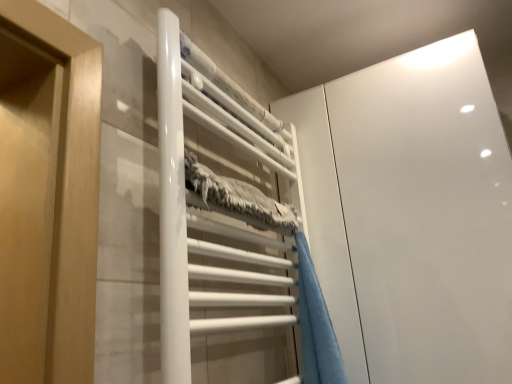
This screenshot has height=384, width=512. Describe the element at coordinates (326, 221) in the screenshot. I see `blue plush towel at center` at that location.

Measure the distance between white glossy cabinet at upper right and camera.

The distance of white glossy cabinet at upper right from camera is 34.53 inches.

This screenshot has width=512, height=384. What do you see at coordinates (210, 208) in the screenshot?
I see `white glossy towel rack at center` at bounding box center [210, 208].

Where is `blue plush towel at center`? Image resolution: width=512 pixels, height=384 pixels. blue plush towel at center is located at coordinates (326, 221).

Which of these two, white glossy cabinet at upper right or white glossy towel rack at center, stands shorter?

white glossy towel rack at center.

How distant is white glossy cabinet at upper right from white glossy towel rack at center?

white glossy cabinet at upper right and white glossy towel rack at center are 31.27 centimeters apart from each other.

From the picture: Is white glossy cabinet at upper right directly adjacent to white glossy towel rack at center?

No, white glossy cabinet at upper right is not in contact with white glossy towel rack at center.

Looking at the image, does white glossy cabinet at upper right seem bigger or smaller compared to white glossy towel rack at center?

In the image, white glossy cabinet at upper right appears to be larger than white glossy towel rack at center.

Does white glossy cabinet at upper right have a smaller size compared to blue plush towel at center?

Actually, white glossy cabinet at upper right might be larger than blue plush towel at center.

You are a GUI agent. You are given a task and a screenshot of the screen. Output one action in this format:
    pyautogui.click(x=<x>, y=<y>)
    Task: Click on the screen door that appears below the white glossy cabinet at upper right (from the image's perspective)
    The width and height of the screenshot is (512, 384).
    Given the screenshot: What is the action you would take?
    pyautogui.click(x=326, y=221)

Consider the image. Does white glossy cabinet at upper right have a lesser height compared to blue plush towel at center?

No, white glossy cabinet at upper right is not shorter than blue plush towel at center.

Does white glossy cabinet at upper right contain blue plush towel at center?

That's incorrect, blue plush towel at center is not inside white glossy cabinet at upper right.

Does blue plush towel at center have a greater width compared to white glossy cabinet at upper right?

No, blue plush towel at center is not wider than white glossy cabinet at upper right.

In the image, there is a blue plush towel at center. Identify the location of glass door above it (from the image's perspective). This screenshot has height=384, width=512. (411, 215).

From the image's perspective, is blue plush towel at center located above white glossy cabinet at upper right?

No, from the image's perspective, blue plush towel at center is not on top of white glossy cabinet at upper right.

Which of these two, blue plush towel at center or white glossy cabinet at upper right, stands shorter?

blue plush towel at center is shorter.

Is white glossy towel rack at center wider or thinner than blue plush towel at center?

Clearly, white glossy towel rack at center has less width compared to blue plush towel at center.

From a real-world perspective, does white glossy towel rack at center stand above blue plush towel at center?

Yes, from a real-world perspective, white glossy towel rack at center is on top of blue plush towel at center.

Considering the sizes of objects white glossy towel rack at center and blue plush towel at center in the image provided, who is smaller, white glossy towel rack at center or blue plush towel at center?

blue plush towel at center.

I want to click on screen door directly beneath the white glossy towel rack at center (from a real-world perspective), so (x=326, y=221).

Is blue plush towel at center at the right side of white glossy towel rack at center?

Indeed, blue plush towel at center is positioned on the right side of white glossy towel rack at center.

From the image's perspective, which is below, blue plush towel at center or white glossy towel rack at center?

From the image's view, blue plush towel at center is below.

From a real-world perspective, is blue plush towel at center positioned over white glossy towel rack at center based on gravity?

No.

Which object is wider, blue plush towel at center or white glossy towel rack at center?

blue plush towel at center.

Is white glossy towel rack at center completely or partially outside of white glossy cabinet at upper right?

Yes, white glossy towel rack at center is outside of white glossy cabinet at upper right.

Who is shorter, white glossy towel rack at center or white glossy cabinet at upper right?

white glossy towel rack at center.

From the image's perspective, which is below, white glossy towel rack at center or white glossy cabinet at upper right?

white glossy cabinet at upper right, from the image's perspective.

Where is `stair that appears below the white glossy cabinet at upper right (from a real-world perspective)`? The width and height of the screenshot is (512, 384). stair that appears below the white glossy cabinet at upper right (from a real-world perspective) is located at coordinates (210, 208).

At what (x,y) coordinates should I click in order to perform the action: click on stair located above the white glossy cabinet at upper right (from the image's perspective). Please return your answer as a coordinate pair (x, y). Looking at the image, I should click on (210, 208).

Locate an element on the screen. The width and height of the screenshot is (512, 384). glass door on the right of the blue plush towel at center is located at coordinates (411, 215).

Based on their spatial positions, is blue plush towel at center or white glossy cabinet at upper right further from white glossy towel rack at center?

The object further to white glossy towel rack at center is white glossy cabinet at upper right.

When comparing their distances from white glossy towel rack at center, does white glossy cabinet at upper right or blue plush towel at center seem further?

white glossy cabinet at upper right.

Estimate the real-world distances between objects in this image. Which object is closer to blue plush towel at center, white glossy towel rack at center or white glossy cabinet at upper right?

white glossy cabinet at upper right is closer to blue plush towel at center.

Looking at the image, which one is located closer to white glossy cabinet at upper right, white glossy towel rack at center or blue plush towel at center?

Among the two, blue plush towel at center is located nearer to white glossy cabinet at upper right.

Considering their positions, is white glossy cabinet at upper right positioned closer to blue plush towel at center than white glossy towel rack at center?

Based on the image, white glossy cabinet at upper right appears to be nearer to blue plush towel at center.

From the image, which object appears to be farther from white glossy cabinet at upper right, blue plush towel at center or white glossy towel rack at center?

white glossy towel rack at center is positioned further to the anchor white glossy cabinet at upper right.

This screenshot has width=512, height=384. In order to click on screen door situated between white glossy towel rack at center and white glossy cabinet at upper right from left to right in this screenshot , I will do `click(326, 221)`.